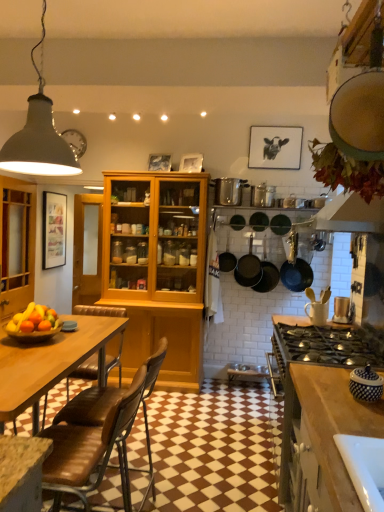
Question: Is point (253, 226) closer or farther from the camera than point (246, 278)?

Choices:
 (A) closer
 (B) farther

Answer: (B)

Question: Considering the positions of matte black frying pan at center, marked as the second frying pan in a left-to-right arrangement, and matte black pans at center, which is the 3th kitchen appliance in right-to-left order, in the image, is matte black frying pan at center, marked as the second frying pan in a left-to-right arrangement, taller or shorter than matte black pans at center, which is the 3th kitchen appliance in right-to-left order,?

Choices:
 (A) short
 (B) tall

Answer: (A)

Question: Which is nearer to the silver metallic pot at center, the third appliance positioned from the front?

Choices:
 (A) matte black pan at upper right, arranged as the 1th kitchen appliance when viewed from the right
 (B) matte gray lampshade at upper left
 (C) matte black pans at center, which is the 3th kitchen appliance in right-to-left order
 (D) metallic silver toaster at right, which appears as the second appliance when viewed from the top
 (E) matte black frying pan at center, which is the first frying pan from right to left

Answer: (E)

Question: Based on their relative distances, which object is nearer to the matte black frying pan at center, which is the 2th frying pan from right to left?

Choices:
 (A) wooden bowl at lower left
 (B) metallic silver toaster at right, acting as the second appliance starting from the front
 (C) white textured jar at lower right, which ranks as the first appliance in bottom-to-top order
 (D) matte black pan at upper right, arranged as the 1th kitchen appliance when viewed from the right
 (E) black matte pans at center, arranged as the 2th kitchen appliance when viewed from the right

Answer: (E)